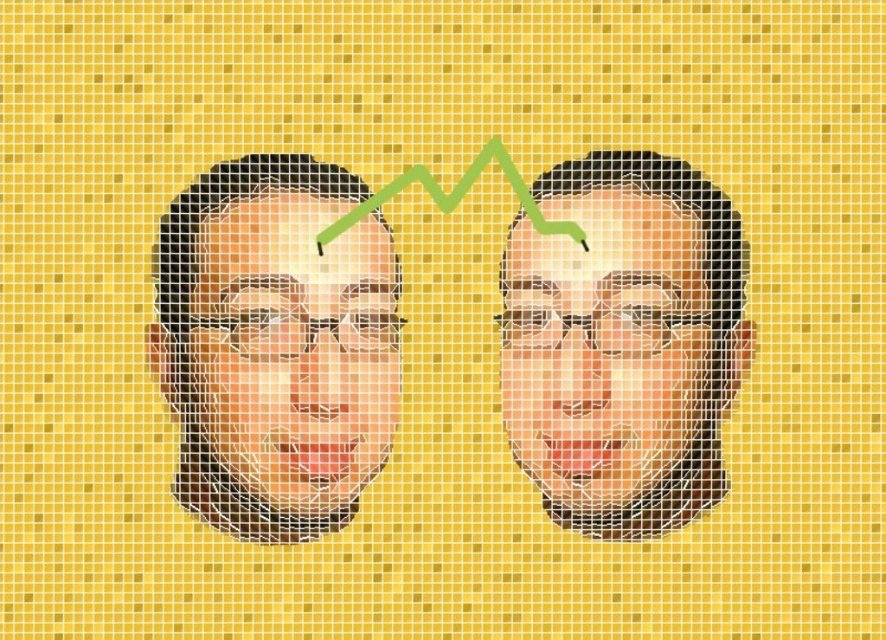
Question: Which object is farther from the camera taking this photo?

Choices:
 (A) smooth skin face at center
 (B) matte black face at center

Answer: (A)

Question: Can you confirm if smooth skin face at center is bigger than matte black face at center?

Choices:
 (A) no
 (B) yes

Answer: (A)

Question: Which point is farther from the camera taking this photo?

Choices:
 (A) (253, 381)
 (B) (626, 493)

Answer: (B)

Question: From the image, what is the correct spatial relationship of smooth skin face at center in relation to matte black face at center?

Choices:
 (A) right
 (B) left

Answer: (A)

Question: Can you confirm if smooth skin face at center is bigger than matte black face at center?

Choices:
 (A) no
 (B) yes

Answer: (A)